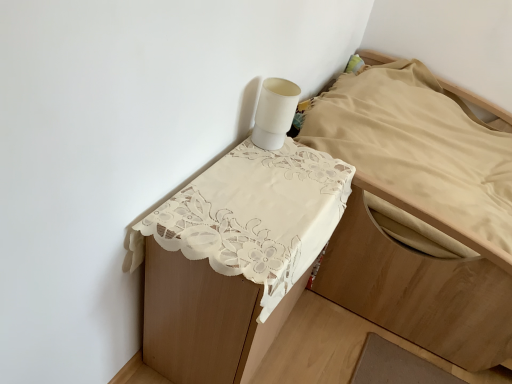
The height and width of the screenshot is (384, 512). Describe the element at coordinates (254, 215) in the screenshot. I see `white lace tablecloth at upper center` at that location.

Find the location of a particular element. white lace tablecloth at upper center is located at coordinates (254, 215).

Image resolution: width=512 pixels, height=384 pixels. What do you see at coordinates (419, 284) in the screenshot?
I see `white lace tablecloth at upper center` at bounding box center [419, 284].

Locate an element on the screen. white lace tablecloth at upper center is located at coordinates (419, 284).

Where is `white lace tablecloth at upper center`? The width and height of the screenshot is (512, 384). white lace tablecloth at upper center is located at coordinates (254, 215).

Considering the relative positions of white lace tablecloth at upper center and white lace tablecloth at upper center in the image provided, is white lace tablecloth at upper center to the left or to the right of white lace tablecloth at upper center?

white lace tablecloth at upper center is to the right of white lace tablecloth at upper center.

Which is in front, white lace tablecloth at upper center or white lace tablecloth at upper center?

Positioned in front is white lace tablecloth at upper center.

Does point (398, 253) come in front of point (209, 222)?

That is False.

From the image's perspective, which one is positioned higher, white lace tablecloth at upper center or white lace tablecloth at upper center?

white lace tablecloth at upper center.

From a real-world perspective, which is physically below, white lace tablecloth at upper center or white lace tablecloth at upper center?

From a 3D spatial view, white lace tablecloth at upper center is below.

Which of these two, white lace tablecloth at upper center or white lace tablecloth at upper center, is wider?

white lace tablecloth at upper center is wider.

Is white lace tablecloth at upper center shorter than white lace tablecloth at upper center?

Yes.

Is white lace tablecloth at upper center bigger than white lace tablecloth at upper center?

Yes, white lace tablecloth at upper center is bigger than white lace tablecloth at upper center.

Can we say white lace tablecloth at upper center lies outside white lace tablecloth at upper center?

Indeed, white lace tablecloth at upper center is completely outside white lace tablecloth at upper center.

Is white lace tablecloth at upper center with white lace tablecloth at upper center?

white lace tablecloth at upper center is not next to white lace tablecloth at upper center, and they're not touching.

Is white lace tablecloth at upper center facing away from white lace tablecloth at upper center?

No.

How different are the orientations of white lace tablecloth at upper center and white lace tablecloth at upper center in degrees?

The angle between the facing direction of white lace tablecloth at upper center and the facing direction of white lace tablecloth at upper center is 179 degrees.

Locate an element on the screen. Image resolution: width=512 pixels, height=384 pixels. furniture positioned vertically above the white lace tablecloth at upper center (from a real-world perspective) is located at coordinates (419, 284).

Which object is positioned more to the left, white lace tablecloth at upper center or white lace tablecloth at upper center?

From the viewer's perspective, white lace tablecloth at upper center appears more on the left side.

Considering the positions of objects white lace tablecloth at upper center and white lace tablecloth at upper center in the image provided, who is behind, white lace tablecloth at upper center or white lace tablecloth at upper center?

Positioned behind is white lace tablecloth at upper center.

Looking at this image, which is farther, (x=138, y=245) or (x=250, y=286)?

Positioned behind is point (x=138, y=245).

From the image's perspective, which one is positioned lower, white lace tablecloth at upper center or white lace tablecloth at upper center?

white lace tablecloth at upper center appears lower in the image.

Looking at this image, from a real-world perspective, is white lace tablecloth at upper center physically above white lace tablecloth at upper center?

No, from a real-world perspective, white lace tablecloth at upper center is not above white lace tablecloth at upper center.

Is white lace tablecloth at upper center wider or thinner than white lace tablecloth at upper center?

In the image, white lace tablecloth at upper center appears to be more narrow than white lace tablecloth at upper center.

Who is taller, white lace tablecloth at upper center or white lace tablecloth at upper center?

With more height is white lace tablecloth at upper center.

Considering the sizes of white lace tablecloth at upper center and white lace tablecloth at upper center in the image, is white lace tablecloth at upper center bigger or smaller than white lace tablecloth at upper center?

In the image, white lace tablecloth at upper center appears to be smaller than white lace tablecloth at upper center.

Is white lace tablecloth at upper center situated inside white lace tablecloth at upper center or outside?

white lace tablecloth at upper center is outside white lace tablecloth at upper center.

Does white lace tablecloth at upper center touch white lace tablecloth at upper center?

No, white lace tablecloth at upper center is not beside white lace tablecloth at upper center.

Could you tell me if white lace tablecloth at upper center is facing white lace tablecloth at upper center?

No, white lace tablecloth at upper center is not aimed at white lace tablecloth at upper center.

Measure the distance between white lace tablecloth at upper center and white lace tablecloth at upper center.

A distance of 17.43 inches exists between white lace tablecloth at upper center and white lace tablecloth at upper center.

Locate an element on the screen. Image resolution: width=512 pixels, height=384 pixels. sheet located underneath the white lace tablecloth at upper center (from a real-world perspective) is located at coordinates (254, 215).

Where is `furniture that appears behind the white lace tablecloth at upper center`? The height and width of the screenshot is (384, 512). furniture that appears behind the white lace tablecloth at upper center is located at coordinates (419, 284).

The image size is (512, 384). Identify the location of sheet located below the white lace tablecloth at upper center (from the image's perspective). (254, 215).